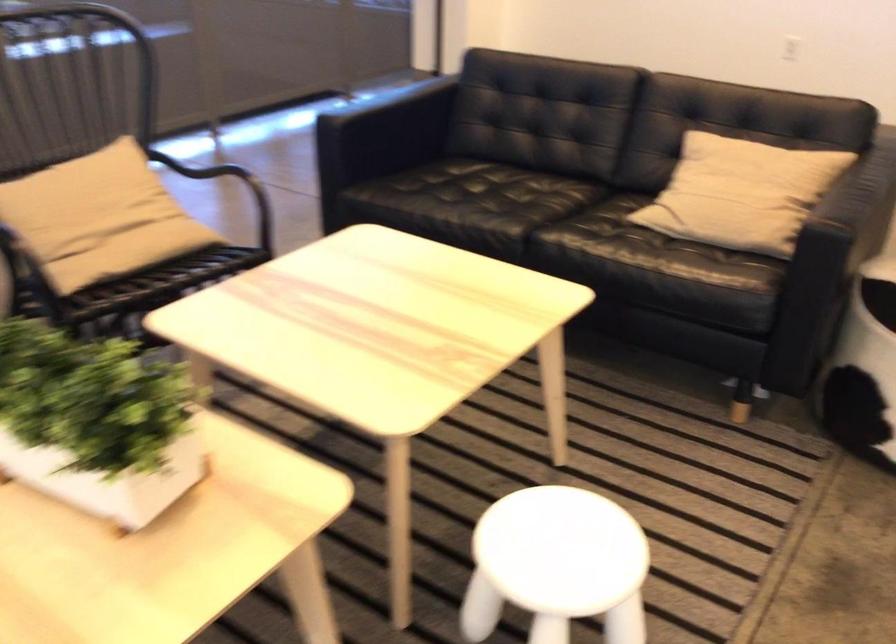
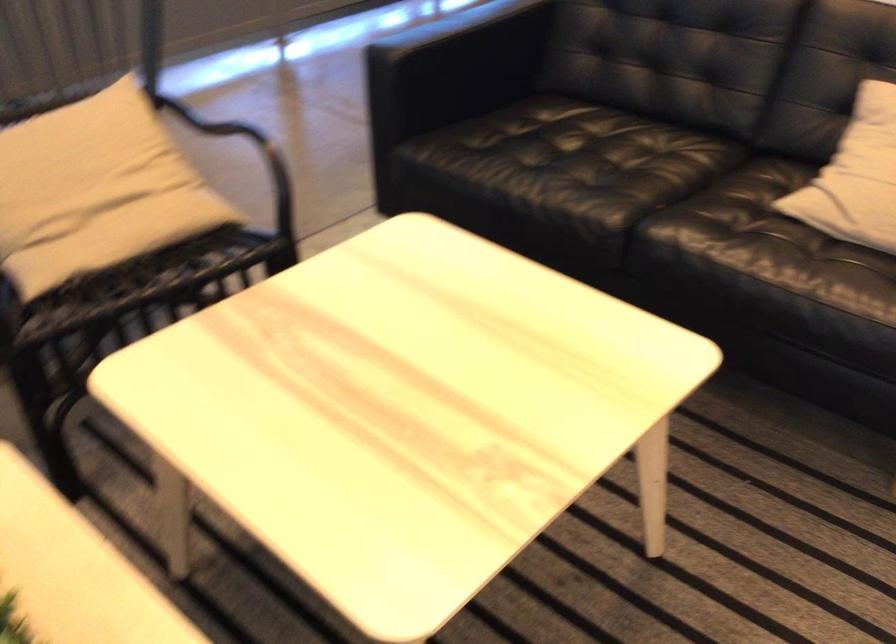
Question: The images are taken continuously from a first-person perspective. In which direction are you moving?

Choices:
 (A) Left
 (B) Right
 (C) Forward
 (D) Backward

Answer: (C)